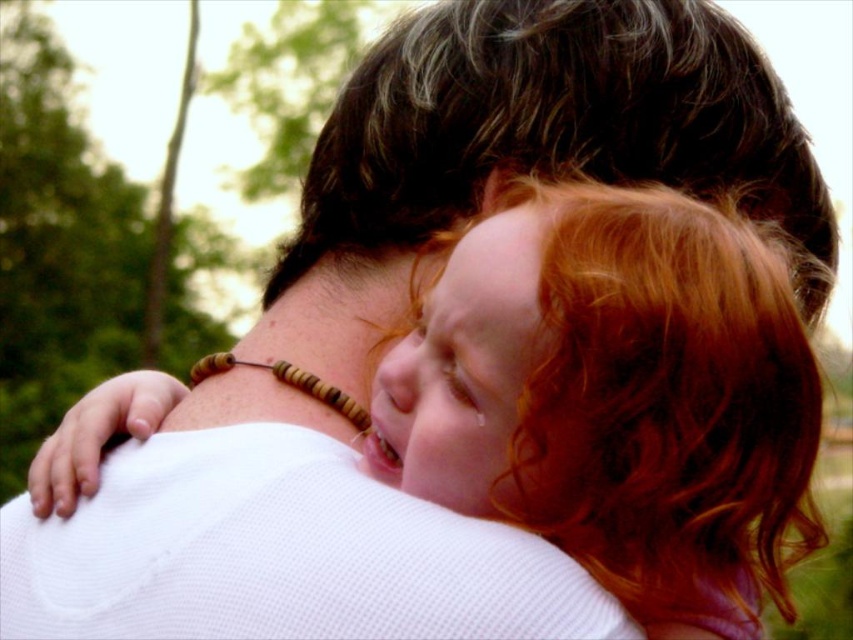
Question: Observing the image, what is the correct spatial positioning of curly red hair at upper right in reference to dark brown wavy hair at upper center?

Choices:
 (A) below
 (B) above

Answer: (A)

Question: Does curly red hair at upper right appear under dark brown wavy hair at upper center?

Choices:
 (A) yes
 (B) no

Answer: (A)

Question: Does curly red hair at upper right appear under dark brown wavy hair at upper center?

Choices:
 (A) no
 (B) yes

Answer: (B)

Question: Which point is farther to the camera?

Choices:
 (A) (462, 134)
 (B) (141, 576)

Answer: (A)